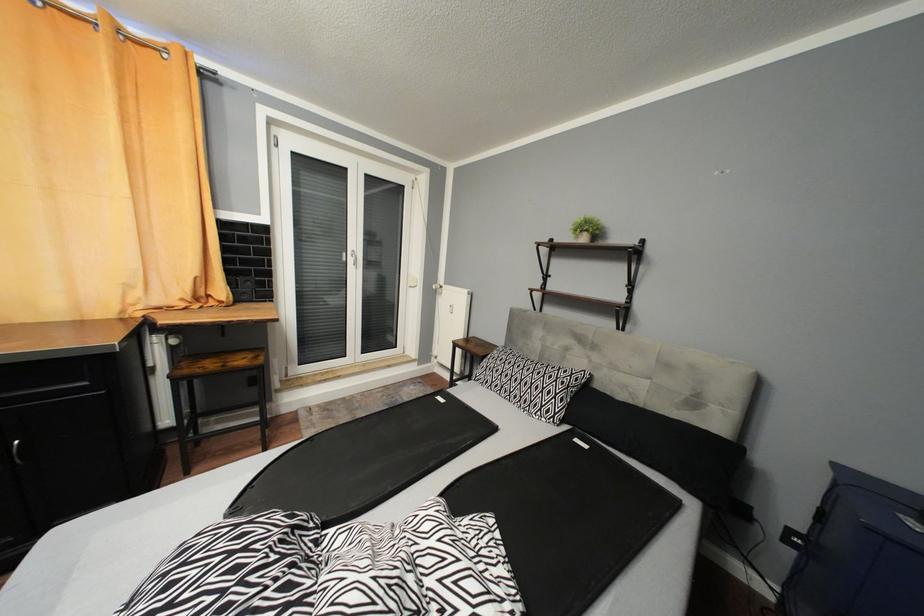
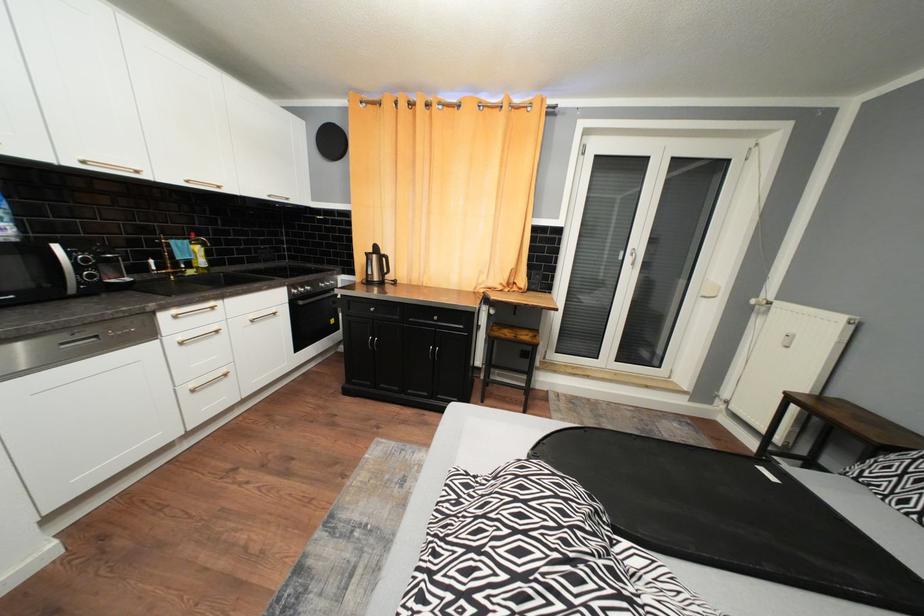
Question: The first image is from the beginning of the video and the second image is from the end. How did the camera likely rotate when shooting the video?

Choices:
 (A) Left
 (B) Right
 (C) Up
 (D) Down

Answer: (A)